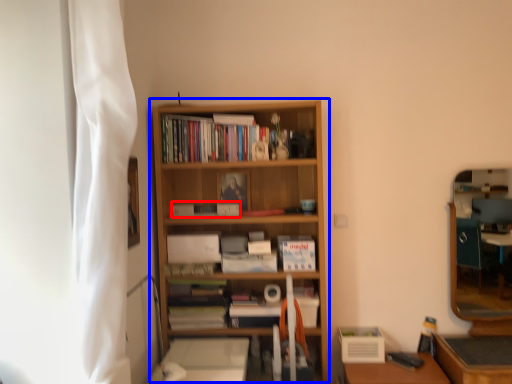
Question: Which object appears closest to the camera in this image, paperback book (highlighted by a red box) or bookcase (highlighted by a blue box)?

Choices:
 (A) paperback book
 (B) bookcase

Answer: (B)